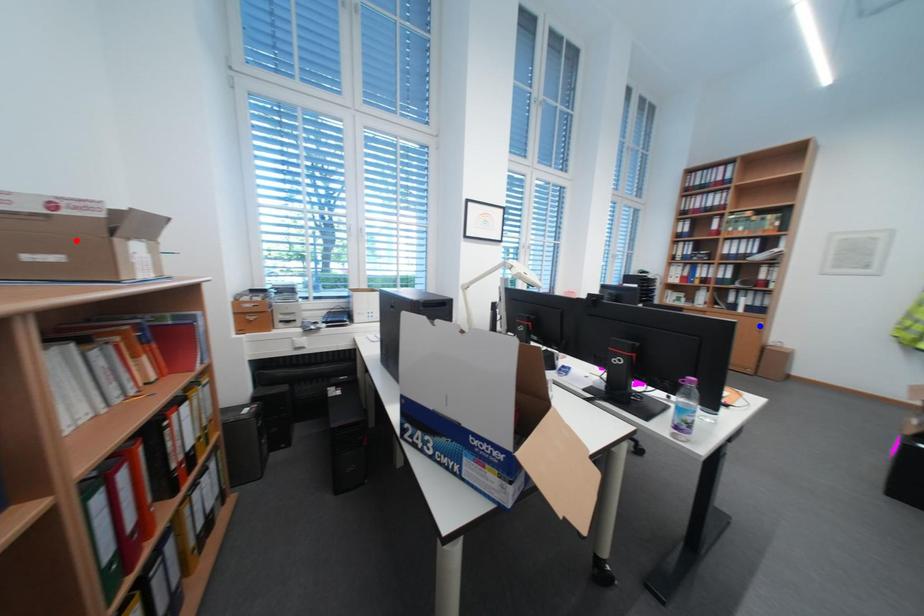
Question: Which of the two points in the image is closer to the camera?

Choices:
 (A) Blue point is closer.
 (B) Red point is closer.

Answer: (B)